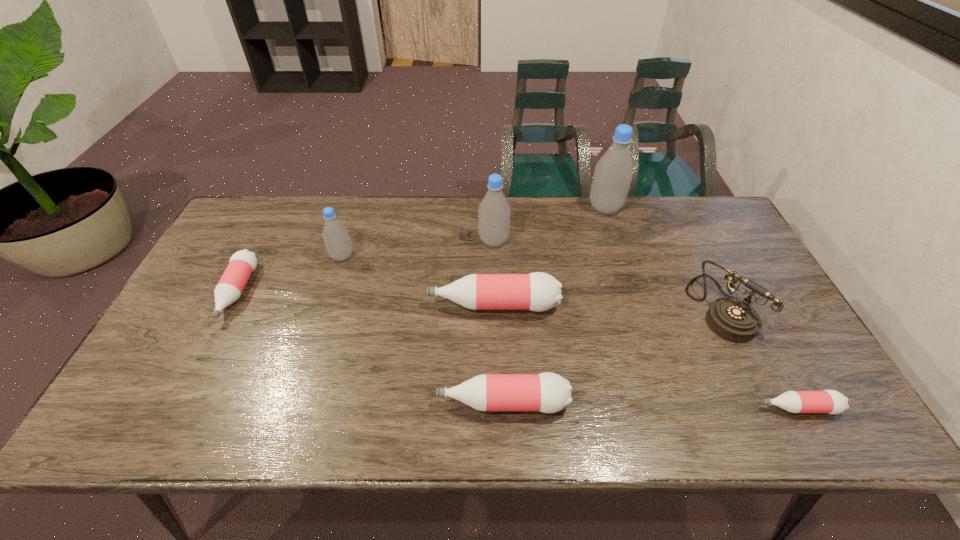
This screenshot has height=540, width=960. What are the coordinates of `gray bottle that stands as the third closest to the fourth tallest bottle` in the screenshot? It's located at (613, 174).

The width and height of the screenshot is (960, 540). I want to click on gray bottle object that ranks as the second closest to the fifth shortest object, so click(x=494, y=211).

Choose which pink bottle is the second nearest neighbor to the leftmost bottle. Please provide its 2D coordinates. Your answer should be formatted as a tuple, i.e. [(x, y)], where the tuple contains the x and y coordinates of a point satisfying the conditions above.

[(547, 392)]

This screenshot has width=960, height=540. I want to click on pink bottle that stands as the second closest to the rightmost bottle, so click(x=538, y=291).

Where is `free location that satisfies the following two spatial constraints: 1. with the cap open on the fourth shortest object; 2. on the back side of the fourth tallest object`? This screenshot has height=540, width=960. free location that satisfies the following two spatial constraints: 1. with the cap open on the fourth shortest object; 2. on the back side of the fourth tallest object is located at coordinates (493, 307).